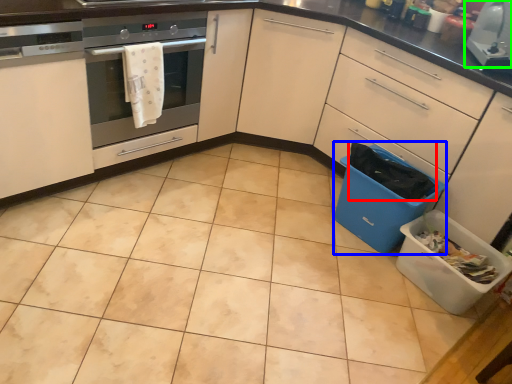
Question: Considering the real-world distances, which object is farthest from material (highlighted by a red box)? recycling bin (highlighted by a blue box) or kitchen appliance (highlighted by a green box)?

Choices:
 (A) recycling bin
 (B) kitchen appliance

Answer: (B)